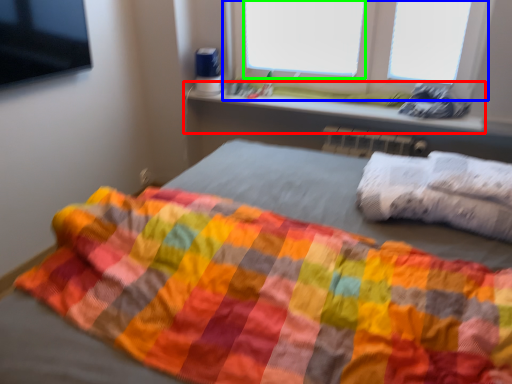
Question: Which object is positioned closest to window sill (highlighted by a red box)? Select from window (highlighted by a blue box) and window screen (highlighted by a green box).

Choices:
 (A) window
 (B) window screen

Answer: (A)